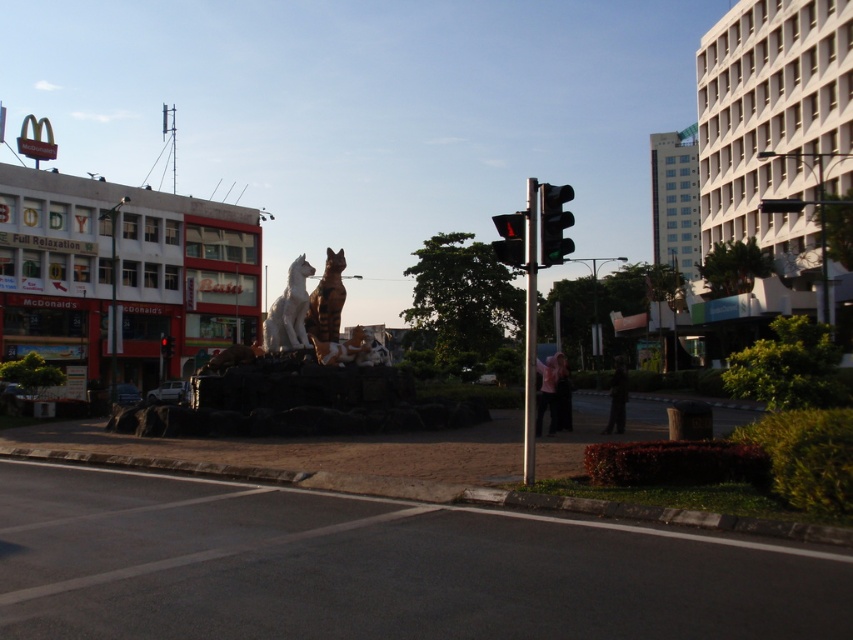
Question: Among these points, which one is nearest to the camera?

Choices:
 (A) (294, 276)
 (B) (167, 349)
 (C) (515, 266)

Answer: (C)

Question: Which object appears farthest from the camera in this image?

Choices:
 (A) black plastic traffic light at upper right
 (B) black asphalt at lower left

Answer: (A)

Question: Can you confirm if brown glossy statue at center is positioned above black plastic traffic light at center?

Choices:
 (A) yes
 (B) no

Answer: (A)

Question: Observing the image, what is the correct spatial positioning of black asphalt at lower left in reference to brown glossy statue at center?

Choices:
 (A) left
 (B) right

Answer: (B)

Question: Does white marble statue at center have a larger size compared to black plastic traffic light at center?

Choices:
 (A) yes
 (B) no

Answer: (A)

Question: Estimate the real-world distances between objects in this image. Which object is farther from the black asphalt at lower left?

Choices:
 (A) brown glossy statue at center
 (B) green glass traffic light at upper right
 (C) white marble statue at center
 (D) black plastic traffic light at upper right

Answer: (C)